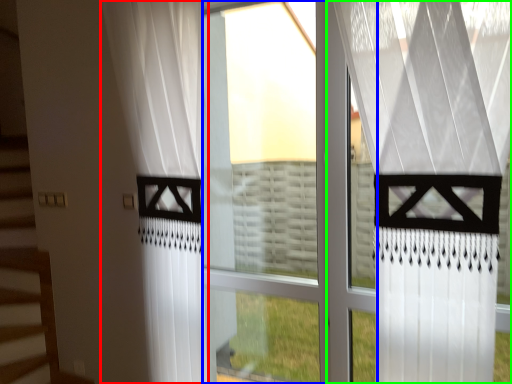
Question: Which object is the farthest from curtain (highlighted by a red box)? Choose among these: glass window (highlighted by a blue box) or curtain (highlighted by a green box).

Choices:
 (A) glass window
 (B) curtain

Answer: (B)